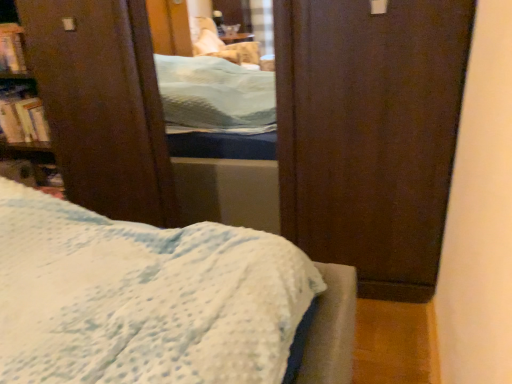
Question: Do you think hardcover book at left, which is the 2th book from top to bottom, is within hardcover book at upper left, placed as the 1th book when sorted from top to bottom, or outside of it?

Choices:
 (A) outside
 (B) inside

Answer: (A)

Question: From a real-world perspective, is hardcover book at left, which is the 2th book from top to bottom, positioned above or below hardcover book at upper left, positioned as the second book in bottom-to-top order?

Choices:
 (A) below
 (B) above

Answer: (A)

Question: Is point (24, 122) closer or farther from the camera than point (11, 52)?

Choices:
 (A) farther
 (B) closer

Answer: (A)

Question: In terms of height, does hardcover book at upper left, positioned as the second book in bottom-to-top order, look taller or shorter compared to hardcover book at left, marked as the 1th book in a bottom-to-top arrangement?

Choices:
 (A) short
 (B) tall

Answer: (B)

Question: From a real-world perspective, is hardcover book at upper left, placed as the 1th book when sorted from top to bottom, above or below hardcover book at left, marked as the 1th book in a bottom-to-top arrangement?

Choices:
 (A) above
 (B) below

Answer: (A)

Question: From the image's perspective, is hardcover book at upper left, placed as the 1th book when sorted from top to bottom, located above or below hardcover book at left, which is the 2th book from top to bottom?

Choices:
 (A) below
 (B) above

Answer: (B)

Question: Based on their sizes in the image, would you say hardcover book at upper left, positioned as the second book in bottom-to-top order, is bigger or smaller than hardcover book at left, marked as the 1th book in a bottom-to-top arrangement?

Choices:
 (A) small
 (B) big

Answer: (B)